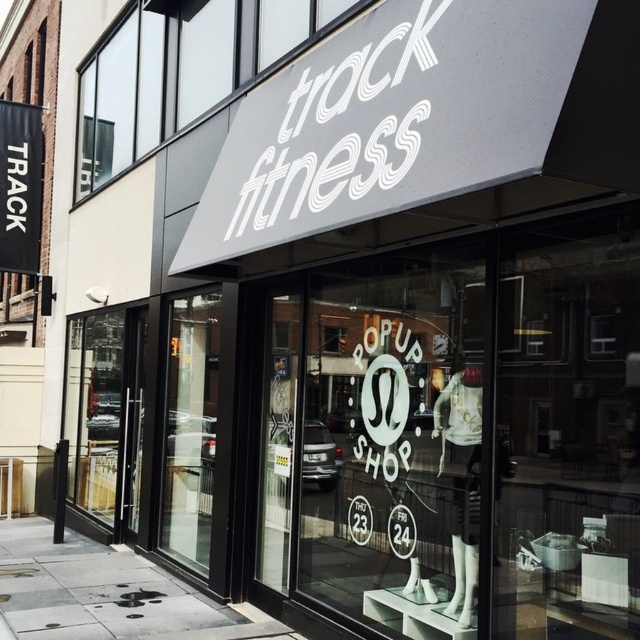
Is point (323, 120) positioned before point (168, 58)?

Yes, point (323, 120) is in front of point (168, 58).

Can you confirm if white matte sign at upper center is wider than white matte signboard at upper center?

In fact, white matte sign at upper center might be narrower than white matte signboard at upper center.

What do you see at coordinates (337, 125) in the screenshot?
I see `white matte sign at upper center` at bounding box center [337, 125].

Where is `white matte sign at upper center`? The image size is (640, 640). white matte sign at upper center is located at coordinates (337, 125).

Does white matte sign at upper center have a larger size compared to gray concrete sidewalk at lower center?

Actually, white matte sign at upper center might be smaller than gray concrete sidewalk at lower center.

Does white matte sign at upper center appear on the right side of gray concrete sidewalk at lower center?

Yes, white matte sign at upper center is to the right of gray concrete sidewalk at lower center.

Which is behind, point (300, 68) or point (122, 563)?

The point (122, 563) is more distant.

Identify the location of white matte sign at upper center. 337,125.

Image resolution: width=640 pixels, height=640 pixels. What do you see at coordinates (477, 435) in the screenshot? I see `transparent glass pop-up shop at center` at bounding box center [477, 435].

Locate an element on the screen. transparent glass pop-up shop at center is located at coordinates (477, 435).